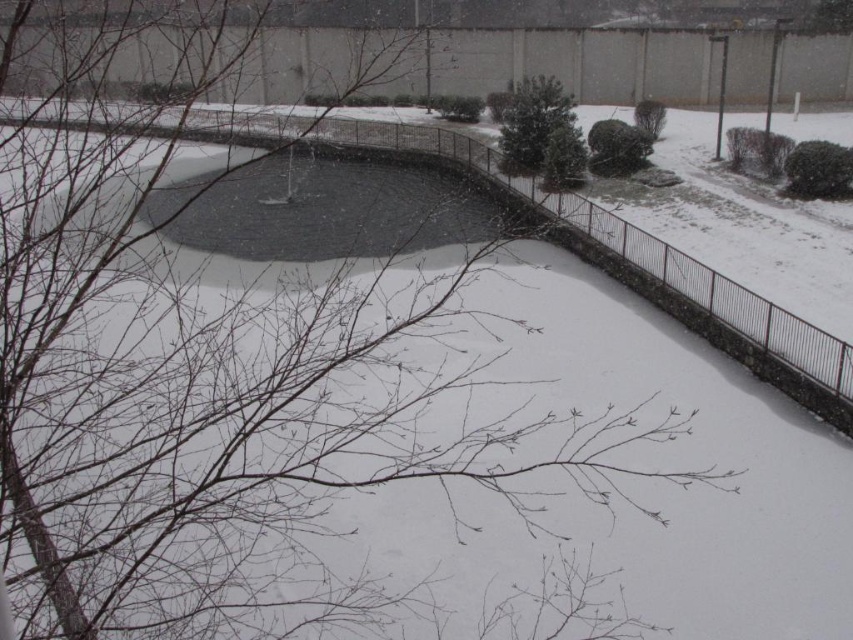
You are standing at the origin point in the snowy scene. There are two points marked in the image. Which point is closer to you, point 1 at coordinates (561, 112) or point 2 at coordinates (612, 172)?

Point 2 at coordinates (612, 172) is closer to you because according to the description, point 1 is behind point 2.

You are standing in the snowy outdoor scene and want to find the green leafy bush at upper center. Which direction should you look relative to the green matte bush at upper right?

The green matte bush at upper right is below the green leafy bush at upper center, so you should look upward from the green matte bush at upper right to find the green leafy bush at upper center.